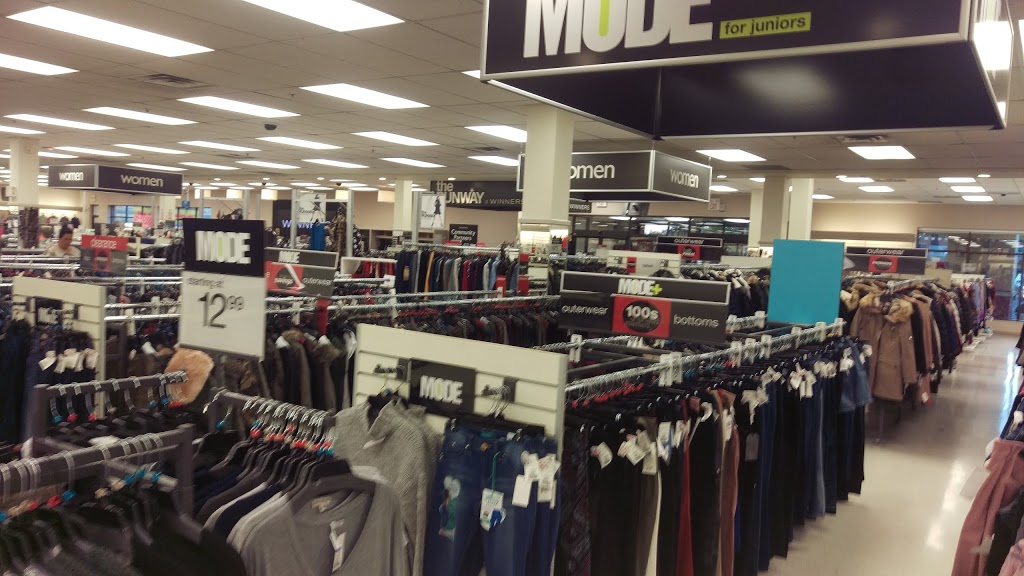
Image resolution: width=1024 pixels, height=576 pixels. Identify the location of shirt rack. (258, 511), (103, 553).